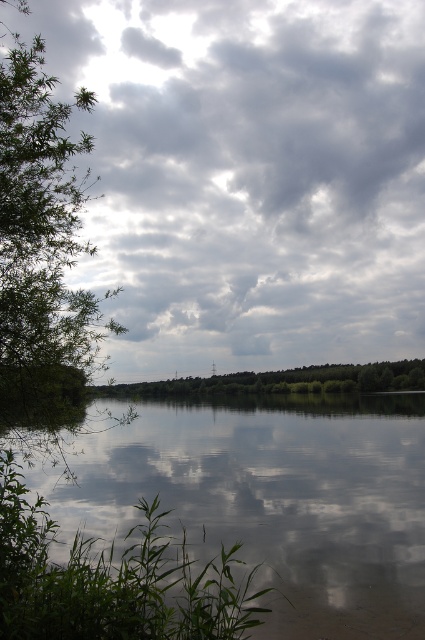
You are a bird flying over the lakeside scene. You want to land between the green leafy tree at left and the green leafy trees at center. How far apart are these two groups of trees from each other?

The green leafy tree at left and the green leafy trees at center are 5.50 meters apart.

You are standing at the lakeside and want to take a photo of the green leafy tree at left and the green leafy trees at center. Which tree group is positioned higher in the frame?

The green leafy tree at left is positioned higher in the frame than the green leafy trees at center.

You are standing at the lakeside and want to take a photo of the cloudy sky at upper center and the green leafy tree at left. Which object will appear larger in the photo?

The cloudy sky at upper center will appear larger in the photo because it is much taller than the green leafy tree at left.